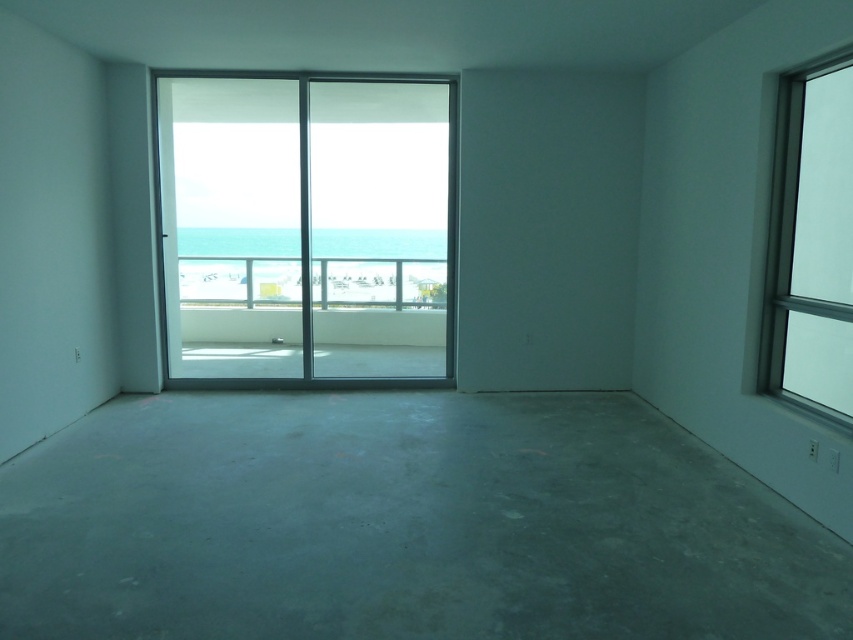
Is point (434, 150) positioned before point (820, 77)?

No, it is behind (820, 77).

Is point (166, 116) positioned in front of point (824, 113)?

No, it is not.

At what (x,y) coordinates should I click in order to perform the action: click on transparent glass screen door at center. Please return your answer as a coordinate pair (x, y). The width and height of the screenshot is (853, 640). Looking at the image, I should click on (306, 228).